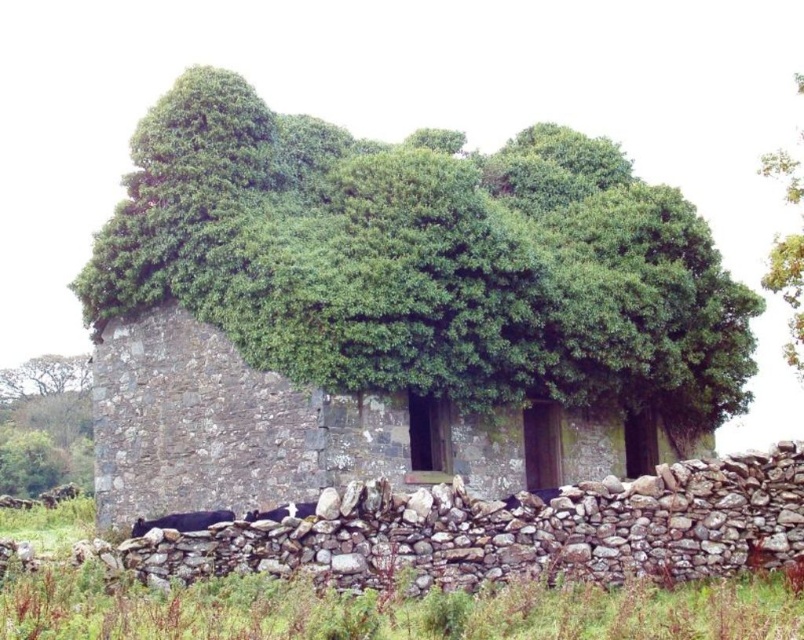
The height and width of the screenshot is (640, 804). What do you see at coordinates (44, 424) in the screenshot?
I see `green leafy tree at upper left` at bounding box center [44, 424].

Who is more forward, (81, 362) or (784, 160)?

Point (784, 160) is more forward.

I want to click on green leafy tree at upper left, so click(x=44, y=424).

Between green leafy tree at center and green leafy tree at upper left, which one has less height?

green leafy tree at upper left

Between green leafy tree at center and green leafy tree at upper left, which one has more height?

green leafy tree at center

Is point (493, 300) closer to viewer compared to point (81, 419)?

Yes, point (493, 300) is closer to viewer.

The width and height of the screenshot is (804, 640). In order to click on green leafy tree at center in this screenshot , I will do `click(425, 262)`.

Who is lower down, green leafy tree at center or green leafy tree at upper right?

green leafy tree at center

Does point (173, 227) come behind point (798, 342)?

No, it is in front of (798, 342).

The image size is (804, 640). I want to click on green leafy tree at center, so click(x=425, y=262).